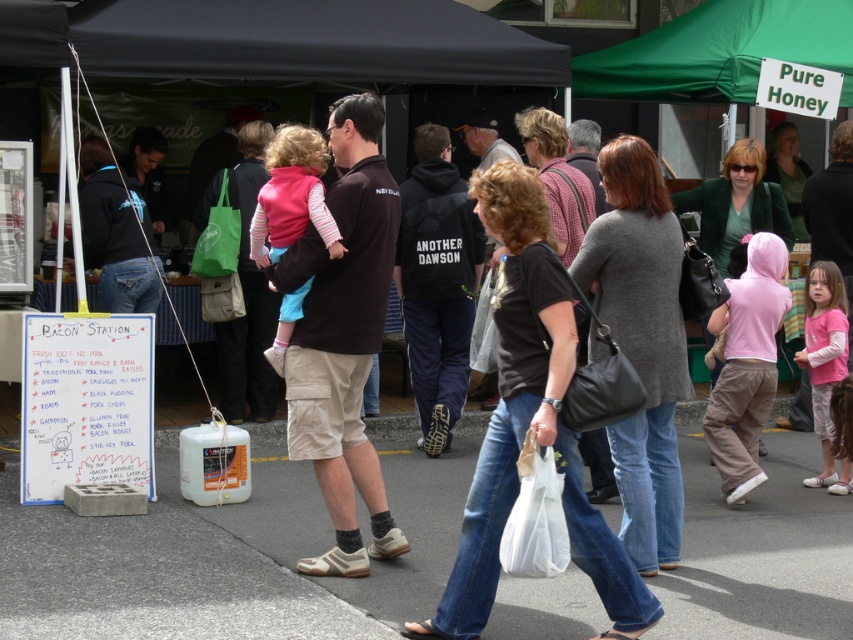
Question: Is gray knitted sweater at center in front of green matte jacket at upper center?

Choices:
 (A) yes
 (B) no

Answer: (A)

Question: Which point is farther from the camera taking this photo?

Choices:
 (A) (801, 160)
 (B) (476, 520)
 (C) (666, 470)
 (D) (735, 561)

Answer: (A)

Question: Is gray knitted sweater at center to the left of green matte jacket at upper center from the viewer's perspective?

Choices:
 (A) no
 (B) yes

Answer: (B)

Question: Does black cotton shirt at center have a larger size compared to gray knitted sweater at center?

Choices:
 (A) no
 (B) yes

Answer: (B)

Question: Among these points, which one is nearest to the camera?

Choices:
 (A) (567, 512)
 (B) (793, 156)
 (C) (103, 621)
 (D) (624, 273)

Answer: (A)

Question: Which object appears closest to the camera in this image?

Choices:
 (A) black cotton shirt at center
 (B) green matte jacket at upper center

Answer: (A)